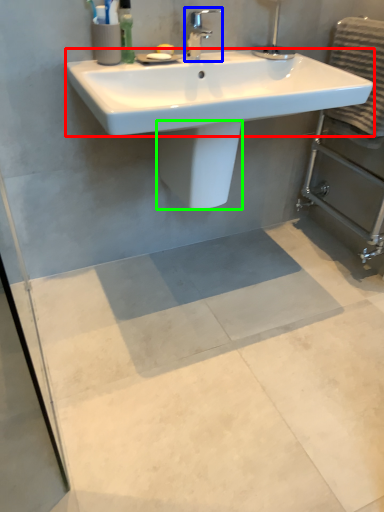
Question: Considering the real-world distances, which object is closest to counter top (highlighted by a red box)? tap (highlighted by a blue box) or bidet (highlighted by a green box).

Choices:
 (A) tap
 (B) bidet

Answer: (B)